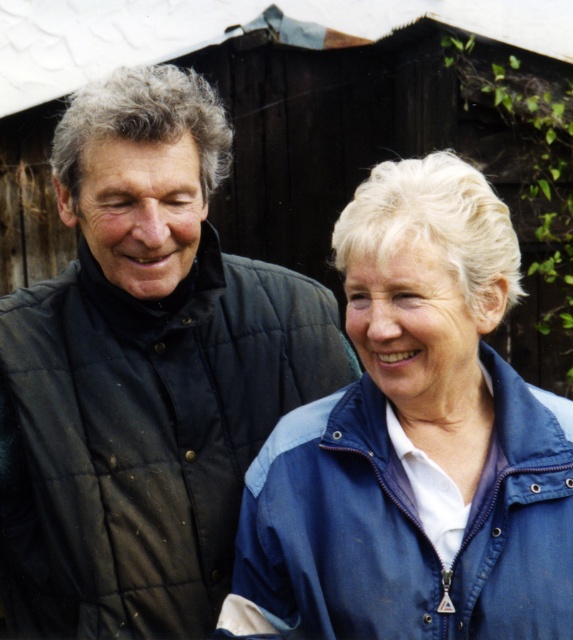
Question: Is the position of matte black jacket at left more distant than that of blue denim jacket at lower right?

Choices:
 (A) yes
 (B) no

Answer: (A)

Question: Which of the following is the closest to the observer?

Choices:
 (A) matte black jacket at left
 (B) blue denim jacket at lower right

Answer: (B)

Question: From the image, what is the correct spatial relationship of matte black jacket at left in relation to blue denim jacket at lower right?

Choices:
 (A) left
 (B) right

Answer: (A)

Question: Among these points, which one is nearest to the camera?

Choices:
 (A) (465, 557)
 (B) (70, 406)

Answer: (A)

Question: Is matte black jacket at left positioned at the back of blue denim jacket at lower right?

Choices:
 (A) no
 (B) yes

Answer: (B)